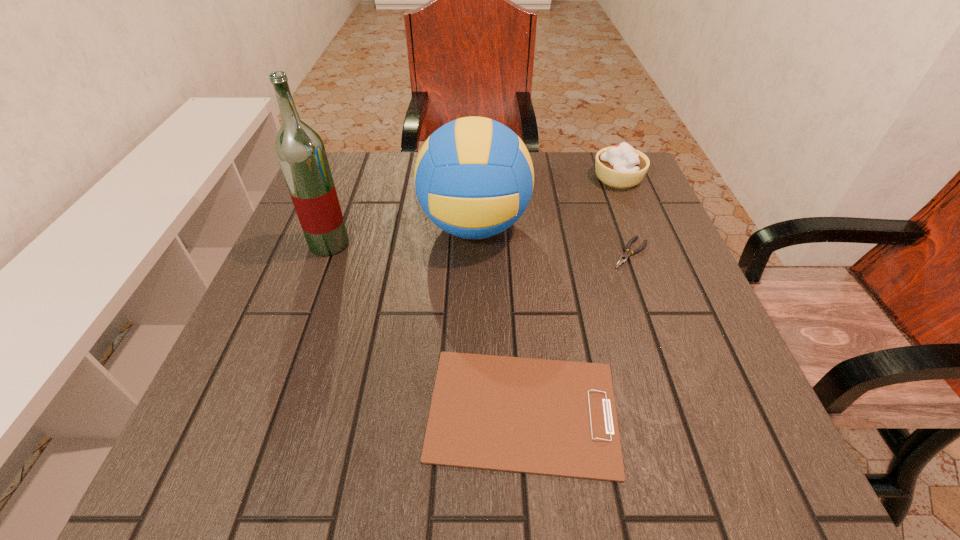
Find the location of a particular element. vacant space located on the front of the pliers is located at coordinates (682, 395).

Locate an element on the screen. This screenshot has height=540, width=960. vacant space situated 0.060m on the right of the nearest object is located at coordinates (659, 410).

You are a GUI agent. You are given a task and a screenshot of the screen. Output one action in this format:
    pyautogui.click(x=<x>, y=<y>)
    Task: Click on the volleyball at the far edge
    
    Given the screenshot: What is the action you would take?
    (474, 177)

The width and height of the screenshot is (960, 540). In order to click on whipped cream situated at the far edge in this screenshot , I will do `click(621, 166)`.

Identify the location of object that is at the near edge. Image resolution: width=960 pixels, height=540 pixels. (550, 417).

Identify the location of object that is at the left edge. Image resolution: width=960 pixels, height=540 pixels. (300, 150).

You are a GUI agent. You are given a task and a screenshot of the screen. Output one action in this format:
    pyautogui.click(x=<x>, y=<y>)
    Task: Click on the whipped cream at the right edge
    
    Given the screenshot: What is the action you would take?
    pyautogui.click(x=621, y=166)

Find the location of a particular element. This screenshot has height=540, width=960. pliers at the right edge is located at coordinates [x=627, y=254].

This screenshot has width=960, height=540. In order to click on object that is at the far right corner in this screenshot , I will do `click(621, 166)`.

In the image, there is a desktop. Where is `free space at the far edge`? free space at the far edge is located at coordinates (562, 160).